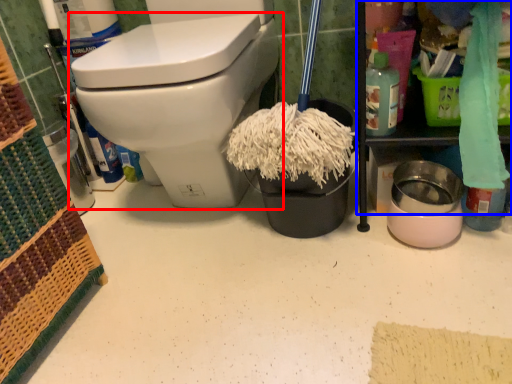
Question: Among these objects, which one is farthest to the camera, toilet (highlighted by a red box) or cabinetry (highlighted by a blue box)?

Choices:
 (A) toilet
 (B) cabinetry

Answer: (A)